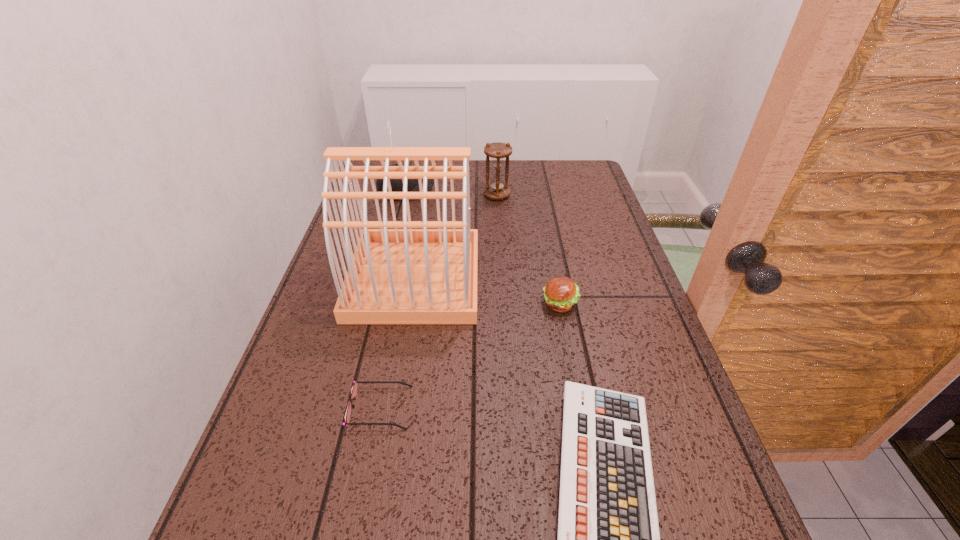
Identify the location of vacant area that lies between the hourglass and the hamburger. The image size is (960, 540). (528, 249).

Locate which object ranks fourth in proximity to the third tallest object. Please provide its 2D coordinates. Your answer should be formatted as a tuple, i.e. [(x, y)], where the tuple contains the x and y coordinates of a point satisfying the conditions above.

[(354, 389)]

Where is `object that ranks as the fifth closest to the computer keyboard`? object that ranks as the fifth closest to the computer keyboard is located at coordinates (396, 184).

The width and height of the screenshot is (960, 540). Find the location of `free space that satisfies the following two spatial constraints: 1. on the front side of the fifth shortest object; 2. with an open door on the tallest object`. free space that satisfies the following two spatial constraints: 1. on the front side of the fifth shortest object; 2. with an open door on the tallest object is located at coordinates (501, 278).

At what (x,y) coordinates should I click in order to perform the action: click on vacant region that satisfies the following two spatial constraints: 1. on the front-facing side of the hamburger; 2. on the left side of the fourth shortest object. Please return your answer as a coordinate pair (x, y). Looking at the image, I should click on (380, 303).

Where is `free point that satisfies the following two spatial constraints: 1. with an open door on the tallest object; 2. on the left side of the hamburger`? The height and width of the screenshot is (540, 960). free point that satisfies the following two spatial constraints: 1. with an open door on the tallest object; 2. on the left side of the hamburger is located at coordinates (411, 303).

Where is `free space that satisfies the following two spatial constraints: 1. on the back side of the fifth shortest object; 2. on the front-facing side of the third tallest object`? The height and width of the screenshot is (540, 960). free space that satisfies the following two spatial constraints: 1. on the back side of the fifth shortest object; 2. on the front-facing side of the third tallest object is located at coordinates (496, 192).